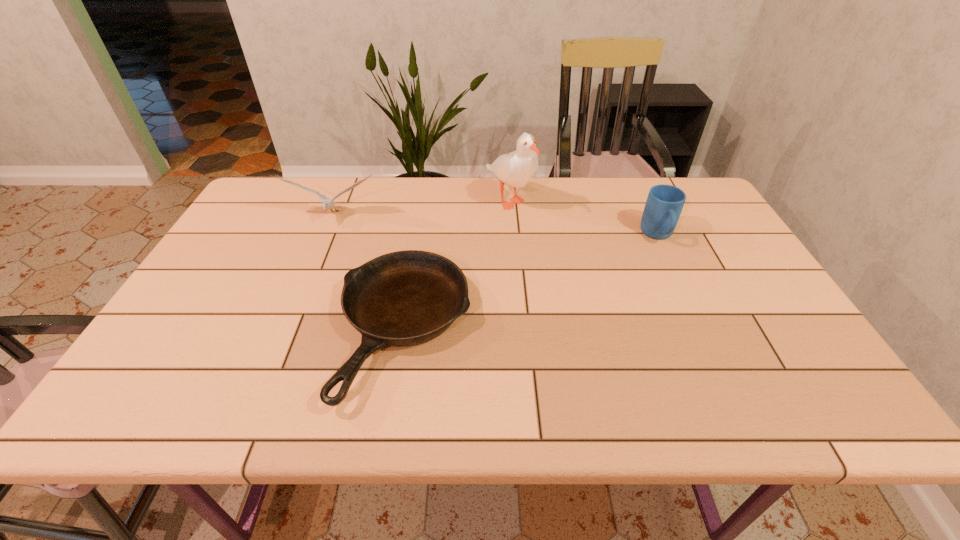
Locate an element on the screen. The height and width of the screenshot is (540, 960). vacant space at the near left corner of the desktop is located at coordinates (186, 409).

The width and height of the screenshot is (960, 540). What are the coordinates of `vacant space at the near right corner of the desktop` in the screenshot? It's located at (768, 396).

Where is `vacant area that lies between the right gull and the third shortest object`? This screenshot has width=960, height=540. vacant area that lies between the right gull and the third shortest object is located at coordinates (421, 208).

Where is `vacant space that is in between the left gull and the taller gull`? vacant space that is in between the left gull and the taller gull is located at coordinates (421, 208).

I want to click on vacant space in between the second shortest object and the tallest object, so click(584, 217).

Locate an element on the screen. The width and height of the screenshot is (960, 540). vacant area that lies between the shortest object and the third tallest object is located at coordinates (531, 282).

Identify the location of free space between the frying pan and the third tallest object. The image size is (960, 540). (531, 282).

The height and width of the screenshot is (540, 960). In order to click on vacant area between the mug and the shortest object in this screenshot , I will do `click(531, 282)`.

Where is `the closest object to the left gull`? This screenshot has width=960, height=540. the closest object to the left gull is located at coordinates (405, 298).

Select which object is the second closest to the taller gull. Please provide its 2D coordinates. Your answer should be formatted as a tuple, i.e. [(x, y)], where the tuple contains the x and y coordinates of a point satisfying the conditions above.

[(664, 204)]